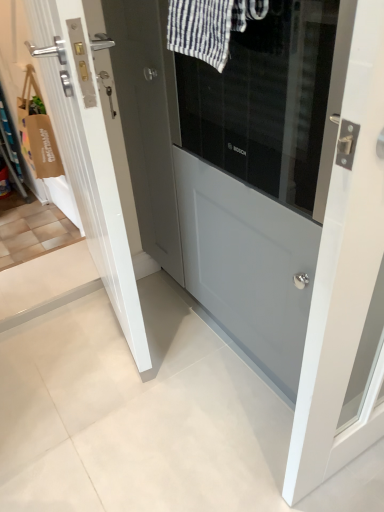
Question: Is white glossy door at center, the 2th door from the right, far from white striped fabric at upper center?

Choices:
 (A) no
 (B) yes

Answer: (A)

Question: Does white glossy door at center, which ranks as the first door in left-to-right order, have a smaller size compared to white striped fabric at upper center?

Choices:
 (A) no
 (B) yes

Answer: (A)

Question: Is white glossy door at center, which ranks as the first door in left-to-right order, to the left of white striped fabric at upper center from the viewer's perspective?

Choices:
 (A) yes
 (B) no

Answer: (A)

Question: Considering the relative sizes of white glossy door at center, the 2th door from the right, and white striped fabric at upper center in the image provided, is white glossy door at center, the 2th door from the right, thinner than white striped fabric at upper center?

Choices:
 (A) no
 (B) yes

Answer: (A)

Question: From the image's perspective, is white glossy door at center, the 2th door from the right, over white striped fabric at upper center?

Choices:
 (A) no
 (B) yes

Answer: (A)

Question: Is white glossy door at center, which ranks as the first door in left-to-right order, situated inside white striped fabric at upper center or outside?

Choices:
 (A) outside
 (B) inside

Answer: (A)

Question: Based on their sizes in the image, would you say white glossy door at center, the 2th door from the right, is bigger or smaller than white striped fabric at upper center?

Choices:
 (A) big
 (B) small

Answer: (A)

Question: Is point (66, 105) closer or farther from the camera than point (226, 17)?

Choices:
 (A) closer
 (B) farther

Answer: (B)

Question: From the image's perspective, is white glossy door at center, the 2th door from the right, positioned above or below white striped fabric at upper center?

Choices:
 (A) below
 (B) above

Answer: (A)

Question: From the image's perspective, is white striped fabric at upper center above or below matte gray door at center, the 1th door positioned from the right?

Choices:
 (A) above
 (B) below

Answer: (A)

Question: Would you say white striped fabric at upper center is inside or outside matte gray door at center, the 2th door viewed from the left?

Choices:
 (A) inside
 (B) outside

Answer: (B)

Question: In terms of width, does white striped fabric at upper center look wider or thinner when compared to matte gray door at center, the 1th door positioned from the right?

Choices:
 (A) thin
 (B) wide

Answer: (A)

Question: Considering the positions of point (185, 35) and point (269, 121), is point (185, 35) closer or farther from the camera than point (269, 121)?

Choices:
 (A) closer
 (B) farther

Answer: (A)

Question: Would you say white striped fabric at upper center is inside or outside white glossy door at center, which ranks as the first door in left-to-right order?

Choices:
 (A) outside
 (B) inside

Answer: (A)

Question: Is white striped fabric at upper center bigger or smaller than white glossy door at center, the 2th door from the right?

Choices:
 (A) big
 (B) small

Answer: (B)